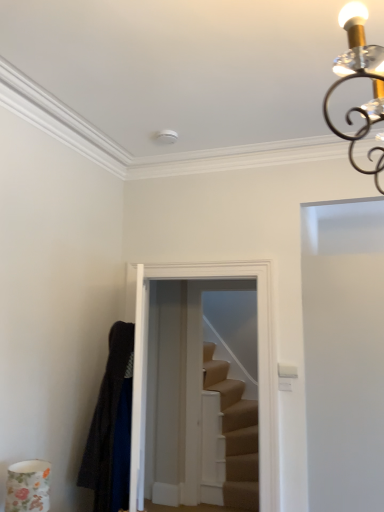
Question: Is the surface of dark woolen robe at left in direct contact with white matte door at right?

Choices:
 (A) no
 (B) yes

Answer: (A)

Question: Does dark woolen robe at left have a larger size compared to white matte door at right?

Choices:
 (A) no
 (B) yes

Answer: (A)

Question: Does dark woolen robe at left come behind white matte door at right?

Choices:
 (A) no
 (B) yes

Answer: (B)

Question: Is dark woolen robe at left to the left of white matte door at right from the viewer's perspective?

Choices:
 (A) no
 (B) yes

Answer: (B)

Question: Considering the relative sizes of dark woolen robe at left and white matte door at right in the image provided, is dark woolen robe at left taller than white matte door at right?

Choices:
 (A) yes
 (B) no

Answer: (B)

Question: Do you think white matte door at right is within dark woolen robe at left, or outside of it?

Choices:
 (A) outside
 (B) inside

Answer: (A)

Question: Based on their positions, is white matte door at right located to the left or right of dark woolen robe at left?

Choices:
 (A) left
 (B) right

Answer: (B)

Question: Is white matte door at right taller or shorter than dark woolen robe at left?

Choices:
 (A) short
 (B) tall

Answer: (B)

Question: In terms of size, does white matte door at right appear bigger or smaller than dark woolen robe at left?

Choices:
 (A) small
 (B) big

Answer: (B)

Question: From their relative heights in the image, would you say white matte door at right is taller or shorter than clear glass door at center?

Choices:
 (A) tall
 (B) short

Answer: (A)

Question: From the image's perspective, is white matte door at right located above or below clear glass door at center?

Choices:
 (A) above
 (B) below

Answer: (B)

Question: From a real-world perspective, is white matte door at right above or below clear glass door at center?

Choices:
 (A) above
 (B) below

Answer: (B)

Question: Considering the positions of white matte door at right and clear glass door at center in the image, is white matte door at right bigger or smaller than clear glass door at center?

Choices:
 (A) big
 (B) small

Answer: (A)

Question: In the image, is dark woolen robe at left on the left side or the right side of white matte door at right?

Choices:
 (A) left
 (B) right

Answer: (A)

Question: Considering their positions, is dark woolen robe at left located in front of or behind white matte door at right?

Choices:
 (A) front
 (B) behind

Answer: (B)